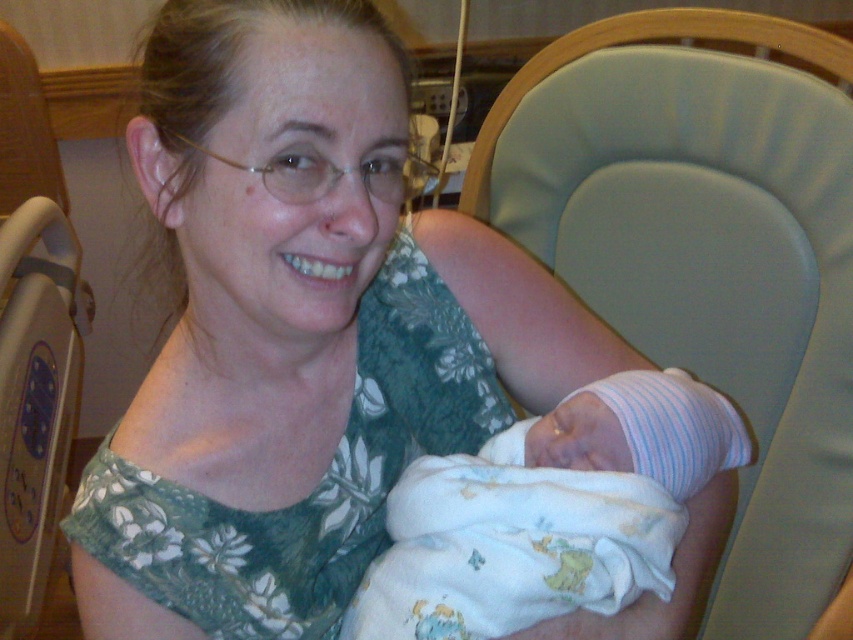
You are a nurse in a hospital room and need to retrieve a medical chart from the desk located behind the light green fabric chair at center. To reach the desk, you must walk around the white soft swaddled newborn at center. Is the path clear to walk around the newborn?

The light green fabric chair at center is located above the white soft swaddled newborn at center, meaning the newborn is positioned lower. Since the chair is above the newborn, there is likely enough space to walk around the newborn to reach the desk behind the chair.

You are a nurse entering the hospital room and need to check the newborn. Which object is closer to you between the light green fabric chair at center and the white soft swaddled newborn at center?

The light green fabric chair at center is closer to you than the white soft swaddled newborn at center, so you should move around it to reach the newborn.